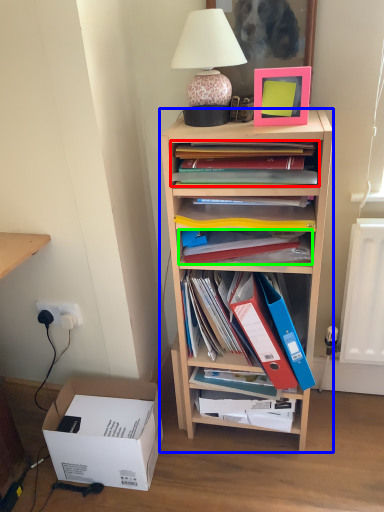
Question: Considering the real-world distances, which object is closest to book (highlighted by a red box)? shelf (highlighted by a blue box) or magazine (highlighted by a green box).

Choices:
 (A) shelf
 (B) magazine

Answer: (B)